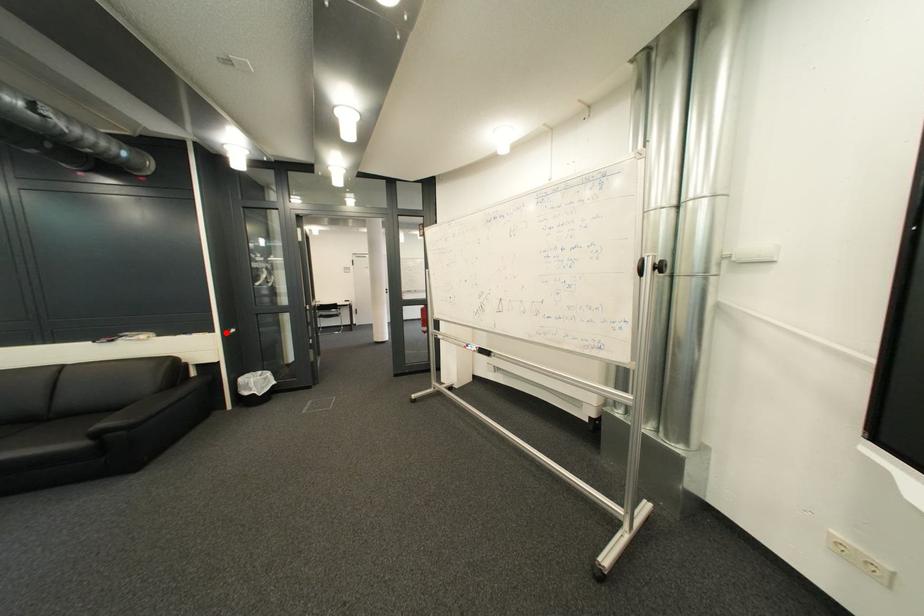
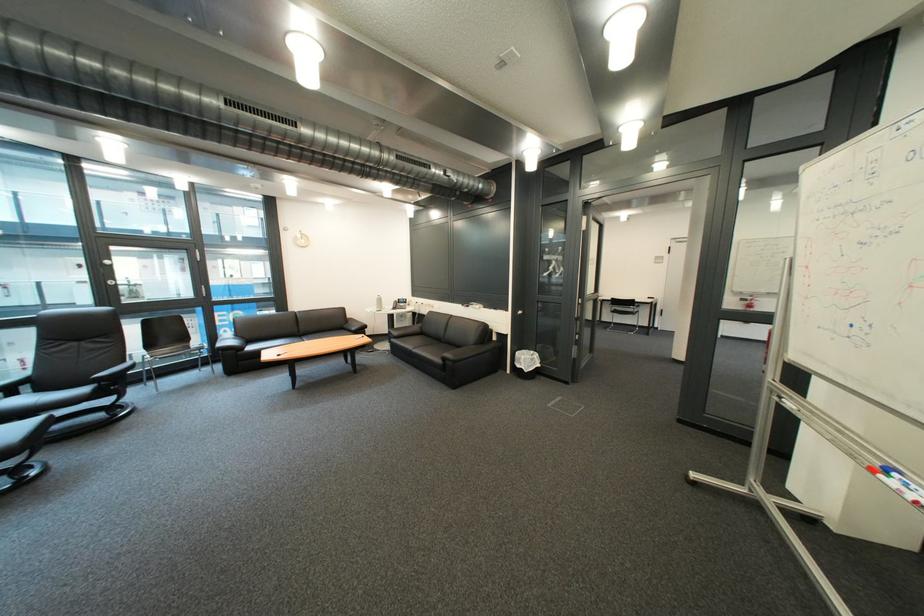
In the second image, find the point that corresponds to the highlighted location in the first image.

(520, 312)